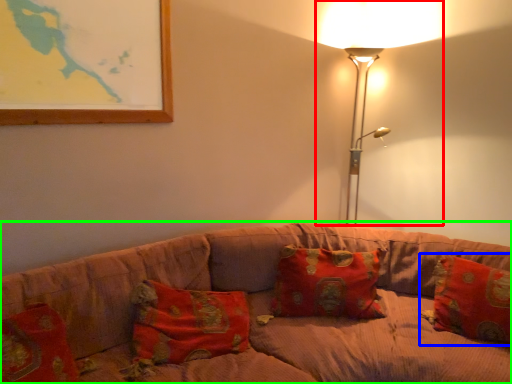
Question: Which object is positioned closest to lamp (highlighted by a red box)? Select from pillow (highlighted by a blue box) and studio couch (highlighted by a green box).

Choices:
 (A) pillow
 (B) studio couch

Answer: (A)